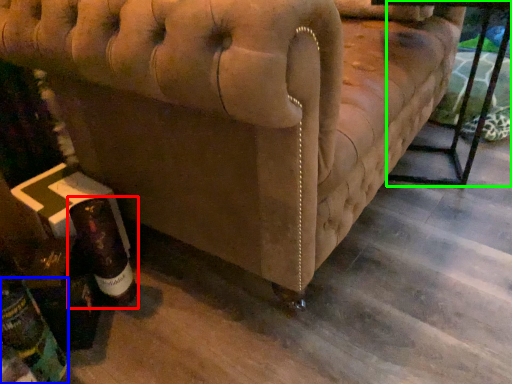
Question: Which is farther away from bottle (highlighted by a red box)? bottle (highlighted by a blue box) or table (highlighted by a green box)?

Choices:
 (A) bottle
 (B) table

Answer: (B)